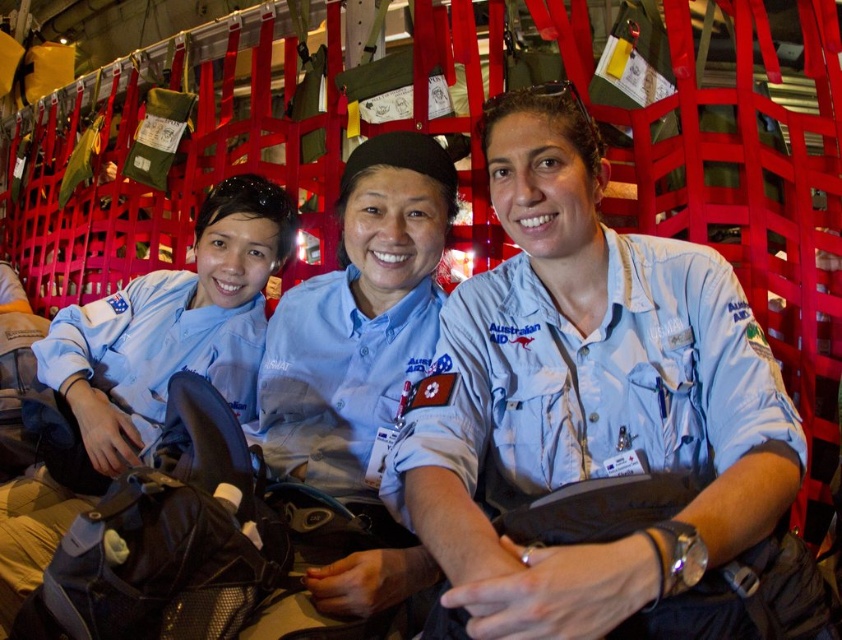
Question: Which object is positioned farthest from the light blue fabric shirt at center?

Choices:
 (A) matte blue uniform at center
 (B) blue uniform shirt at center

Answer: (A)

Question: Is blue uniform shirt at center above matte blue uniform at center?

Choices:
 (A) no
 (B) yes

Answer: (A)

Question: Which of the following is the farthest from the observer?

Choices:
 (A) (64, 513)
 (B) (322, 433)

Answer: (A)

Question: Is light blue fabric shirt at center behind matte blue uniform at center?

Choices:
 (A) no
 (B) yes

Answer: (A)

Question: From the image, what is the correct spatial relationship of light blue fabric shirt at center in relation to blue uniform shirt at center?

Choices:
 (A) above
 (B) below

Answer: (B)

Question: Estimate the real-world distances between objects in this image. Which object is farther from the light blue fabric shirt at center?

Choices:
 (A) blue uniform shirt at center
 (B) matte blue uniform at center

Answer: (B)